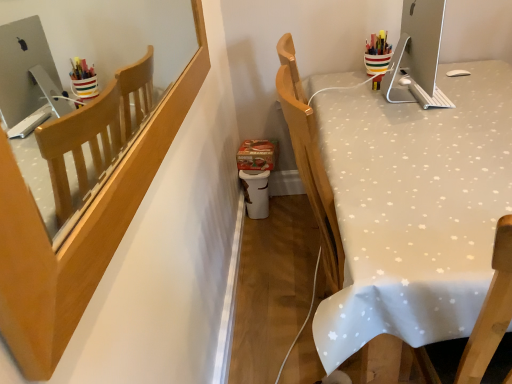
Locate an element on the screen. The image size is (512, 384). free space in front of satin silver monitor at upper right is located at coordinates (434, 128).